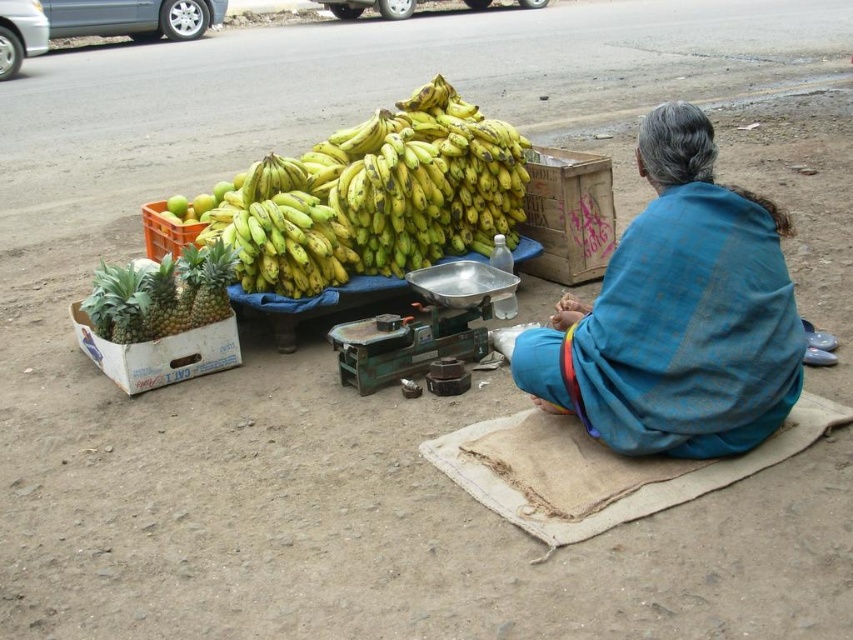
Question: Is blue fabric shawl at center below metallic scale at center?

Choices:
 (A) yes
 (B) no

Answer: (B)

Question: Which object is positioned farthest from the green matte pineapple at left?

Choices:
 (A) yellow matte bananas at center
 (B) blue fabric shawl at center

Answer: (B)

Question: Which is nearer to the metallic scale at center?

Choices:
 (A) blue fabric shawl at center
 (B) green matte pineapple at left

Answer: (A)

Question: Among these points, which one is farthest from the camera?

Choices:
 (A) (108, 333)
 (B) (428, 234)

Answer: (B)

Question: Is yellow matte bananas at center in front of metallic scale at center?

Choices:
 (A) yes
 (B) no

Answer: (B)

Question: Is blue fabric shawl at center wider than green matte pineapple at left?

Choices:
 (A) yes
 (B) no

Answer: (A)